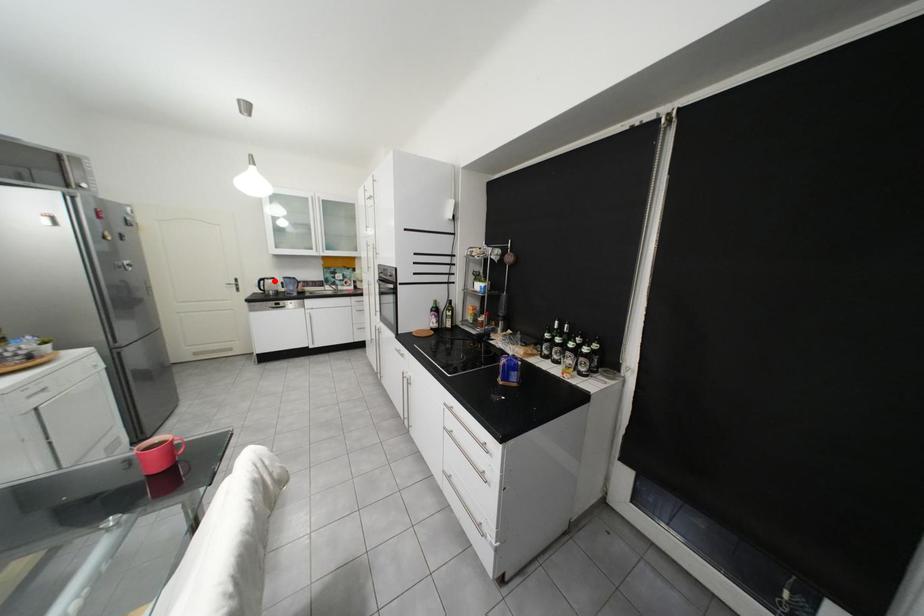
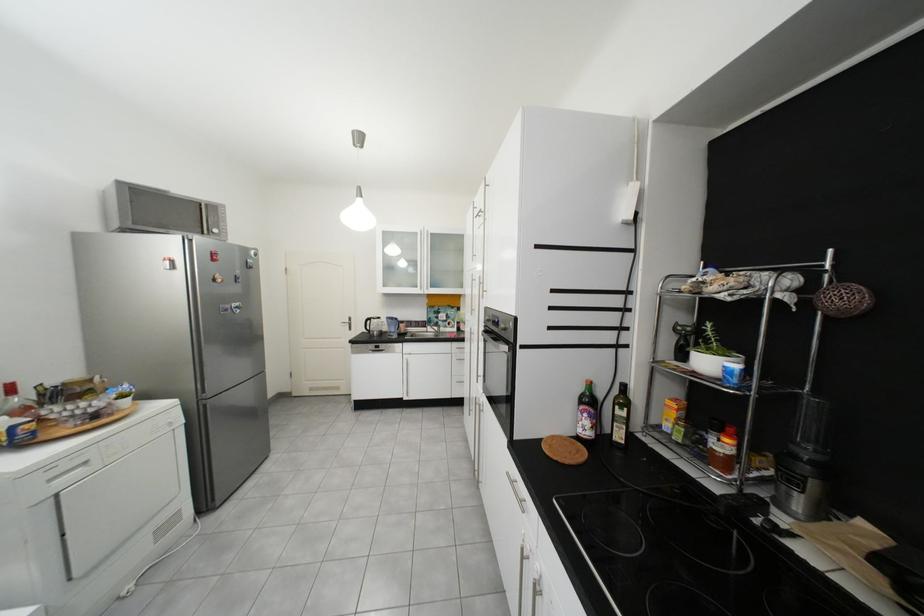
Question: I am providing you with two images of the same scene from different viewpoints. In image1, a red point is highlighted. Considering the same 3D point in image2, which of the following is correct?

Choices:
 (A) It is closer
 (B) It is farther

Answer: (B)